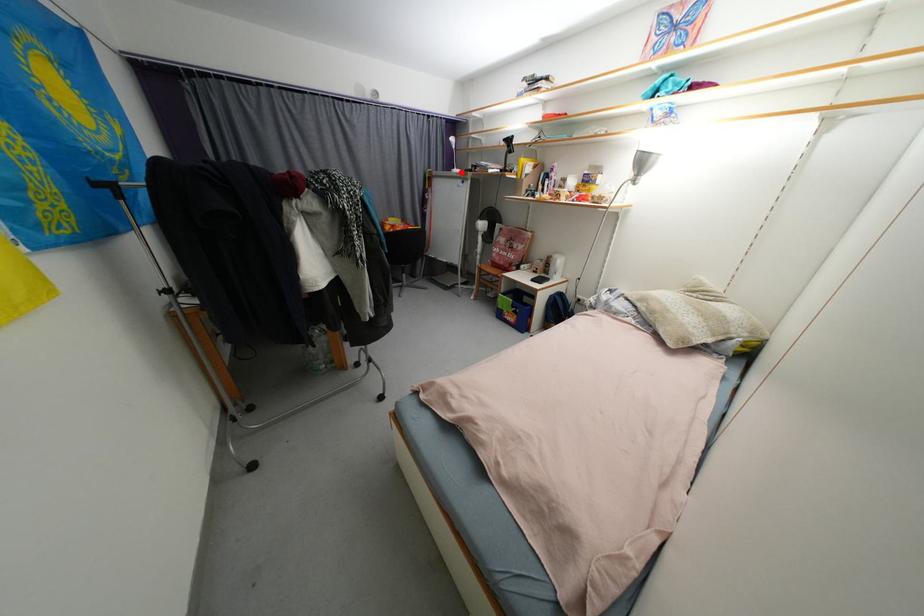
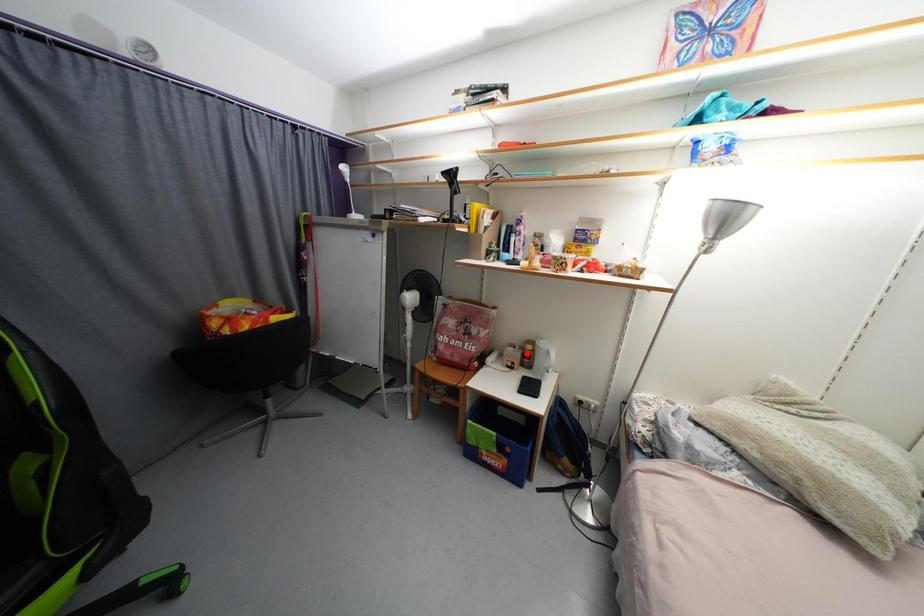
I am providing you with two images of the same scene from different viewpoints. A red point is marked on the first image and another point is marked on the second image. Is the red point in image1 aligned with the point shown in image2?

No